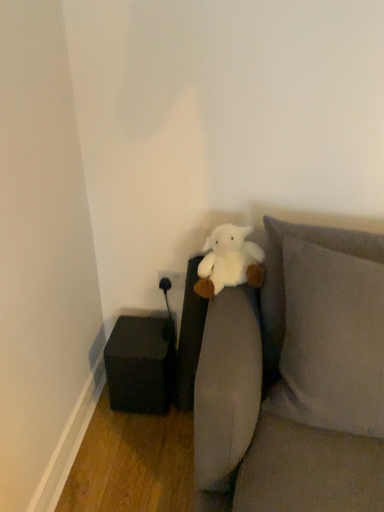
Question: Does black matte cube at lower left have a lesser width compared to white plush at center?

Choices:
 (A) no
 (B) yes

Answer: (A)

Question: From the image's perspective, does black matte cube at lower left appear lower than white plush at center?

Choices:
 (A) yes
 (B) no

Answer: (A)

Question: Is black matte cube at lower left further to camera compared to white plush at center?

Choices:
 (A) no
 (B) yes

Answer: (B)

Question: From a real-world perspective, is black matte cube at lower left on top of white plush at center?

Choices:
 (A) no
 (B) yes

Answer: (A)

Question: Is black matte cube at lower left next to white plush at center and touching it?

Choices:
 (A) yes
 (B) no

Answer: (B)

Question: Relative to soft gray fabric couch at center, is white plush at center in front or behind?

Choices:
 (A) behind
 (B) front

Answer: (A)

Question: Is white plush at center spatially inside soft gray fabric couch at center, or outside of it?

Choices:
 (A) outside
 (B) inside

Answer: (B)

Question: Considering the relative positions of white plush at center and soft gray fabric couch at center in the image provided, is white plush at center to the left or to the right of soft gray fabric couch at center?

Choices:
 (A) left
 (B) right

Answer: (A)

Question: Considering the positions of point (205, 297) and point (269, 439), is point (205, 297) closer or farther from the camera than point (269, 439)?

Choices:
 (A) closer
 (B) farther

Answer: (B)

Question: In the image, is white plush at center positioned in front of or behind black matte cube at lower left?

Choices:
 (A) behind
 (B) front

Answer: (B)

Question: Is white plush at center spatially inside black matte cube at lower left, or outside of it?

Choices:
 (A) inside
 (B) outside

Answer: (B)

Question: Considering the relative positions of white plush at center and black matte cube at lower left in the image provided, is white plush at center to the left or to the right of black matte cube at lower left?

Choices:
 (A) right
 (B) left

Answer: (A)

Question: Is white plush at center wider or thinner than black matte cube at lower left?

Choices:
 (A) wide
 (B) thin

Answer: (B)

Question: Considering the positions of black matte cube at lower left and soft gray fabric couch at center in the image, is black matte cube at lower left bigger or smaller than soft gray fabric couch at center?

Choices:
 (A) big
 (B) small

Answer: (B)

Question: In the image, is black matte cube at lower left positioned in front of or behind soft gray fabric couch at center?

Choices:
 (A) behind
 (B) front

Answer: (A)